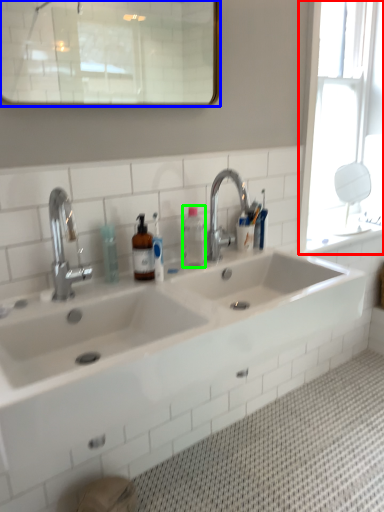
Question: Which object is positioned farthest from window (highlighted by a red box)? Select from mirror (highlighted by a blue box) and bottle (highlighted by a green box).

Choices:
 (A) mirror
 (B) bottle

Answer: (A)